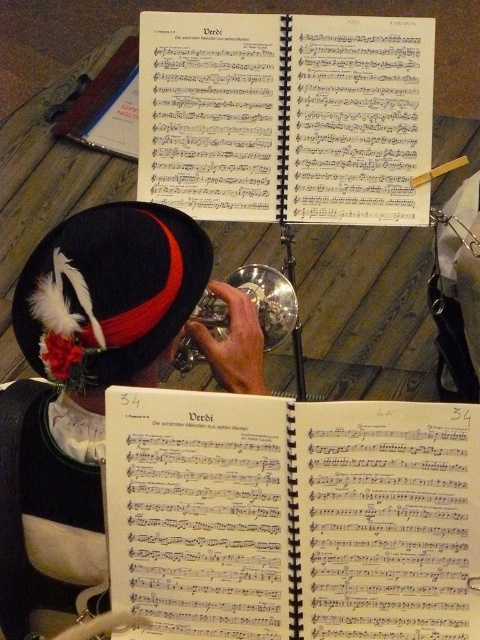
Question: Which of the following is the closest to the observer?

Choices:
 (A) (98, 269)
 (B) (194, 316)
 (C) (71, 433)

Answer: (A)

Question: Does velvet hat at center have a greater width compared to velvet black hat with feather at upper left?

Choices:
 (A) no
 (B) yes

Answer: (B)

Question: Observing the image, what is the correct spatial positioning of velvet black hat with feather at upper left in reference to silver metallic trumpet at center?

Choices:
 (A) below
 (B) above

Answer: (B)

Question: Which of the following is the closest to the observer?

Choices:
 (A) (81, 394)
 (B) (120, 220)
 (C) (267, 308)

Answer: (B)

Question: Is velvet black hat with feather at upper left behind silver metallic trumpet at center?

Choices:
 (A) yes
 (B) no

Answer: (B)

Question: Which object is the closest to the silver metallic trumpet at center?

Choices:
 (A) velvet black hat with feather at upper left
 (B) velvet hat at center

Answer: (B)